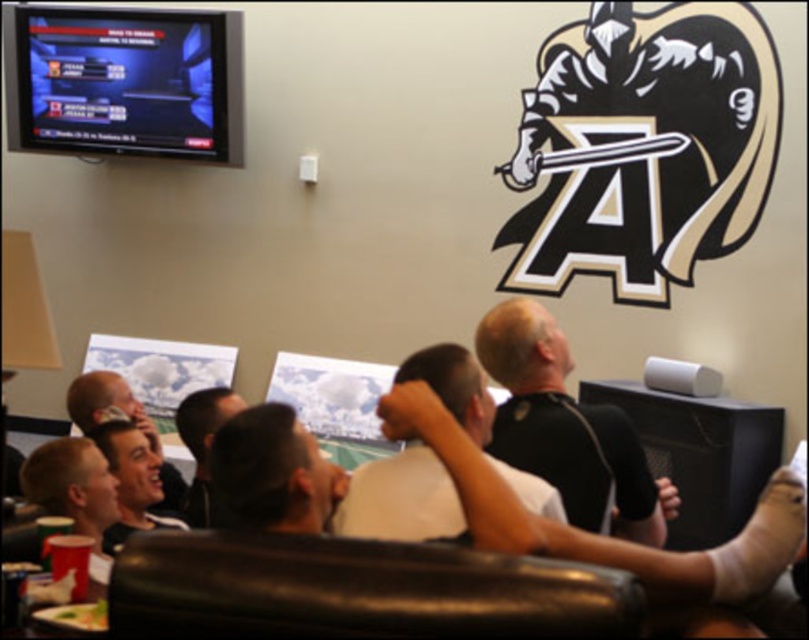
Question: Does black leather couch at lower center have a lesser width compared to matte black shirt at center?

Choices:
 (A) yes
 (B) no

Answer: (B)

Question: Does black t-shirt at center have a lesser width compared to black matte shirt at center?

Choices:
 (A) no
 (B) yes

Answer: (A)

Question: Which point is closer to the camera?

Choices:
 (A) matte black screen at upper left
 (B) black leather couch at lower center

Answer: (B)

Question: Can you confirm if black leather couch at lower center is positioned to the right of black t-shirt at center?

Choices:
 (A) no
 (B) yes

Answer: (A)

Question: Which object appears closest to the camera in this image?

Choices:
 (A) black t-shirt at center
 (B) matte black shirt at lower left
 (C) dark brown hair at center

Answer: (A)

Question: Which object is positioned closest to the dark brown hair at center?

Choices:
 (A) black matte shirt at center
 (B) matte black shirt at center
 (C) matte black shirt at lower left

Answer: (B)